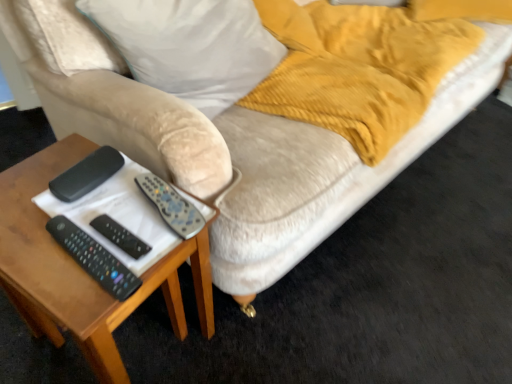
Identify the location of vacant area that lies between black plastic remote at center, positioned as the second remote in top-to-bottom order, and silver metallic remote at center, the first remote when ordered from top to bottom. This screenshot has width=512, height=384. [136, 225].